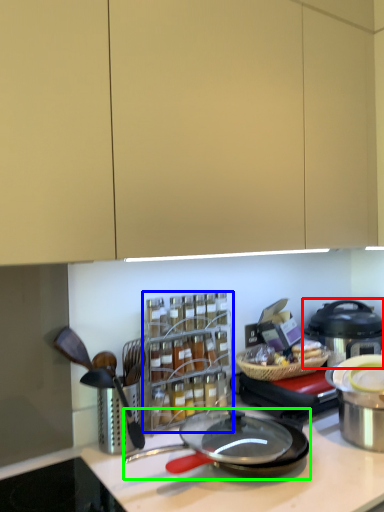
Question: Which is nearer to the kitchen appliance (highlighted by a red box)? spice rack (highlighted by a blue box) or frying pan (highlighted by a green box).

Choices:
 (A) spice rack
 (B) frying pan

Answer: (A)